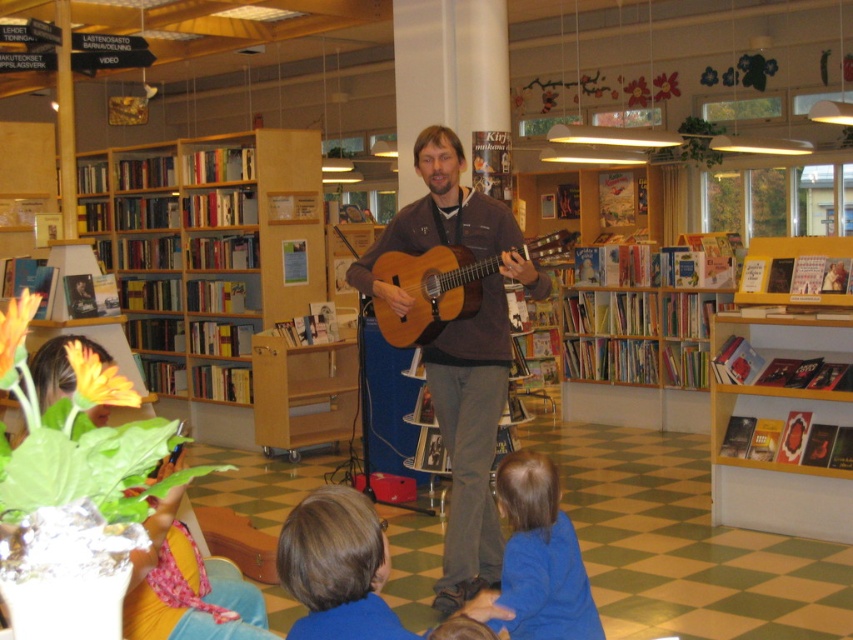
Which of these two, wooden bookshelf at left or matte brown guitar at center, stands shorter?

With less height is matte brown guitar at center.

Who is more distant from viewer, (235, 346) or (448, 230)?

Point (235, 346)

At what (x,y) coordinates should I click in order to perform the action: click on wooden bookshelf at left. Please return your answer as a coordinate pair (x, y). Looking at the image, I should click on (207, 259).

Who is lower down, wooden bookshelf at left or yellow wooden bookshelf at right?

Positioned lower is yellow wooden bookshelf at right.

The height and width of the screenshot is (640, 853). What do you see at coordinates (207, 259) in the screenshot? I see `wooden bookshelf at left` at bounding box center [207, 259].

Where is `wooden bookshelf at left`? Image resolution: width=853 pixels, height=640 pixels. wooden bookshelf at left is located at coordinates (207, 259).

Does matte brown guitar at center have a smaller size compared to yellow wooden bookshelf at right?

Incorrect, matte brown guitar at center is not smaller in size than yellow wooden bookshelf at right.

Who is higher up, matte brown guitar at center or yellow wooden bookshelf at right?

matte brown guitar at center

This screenshot has height=640, width=853. What do you see at coordinates (460, 349) in the screenshot? I see `matte brown guitar at center` at bounding box center [460, 349].

The image size is (853, 640). What are the coordinates of `matte brown guitar at center` in the screenshot? It's located at (460, 349).